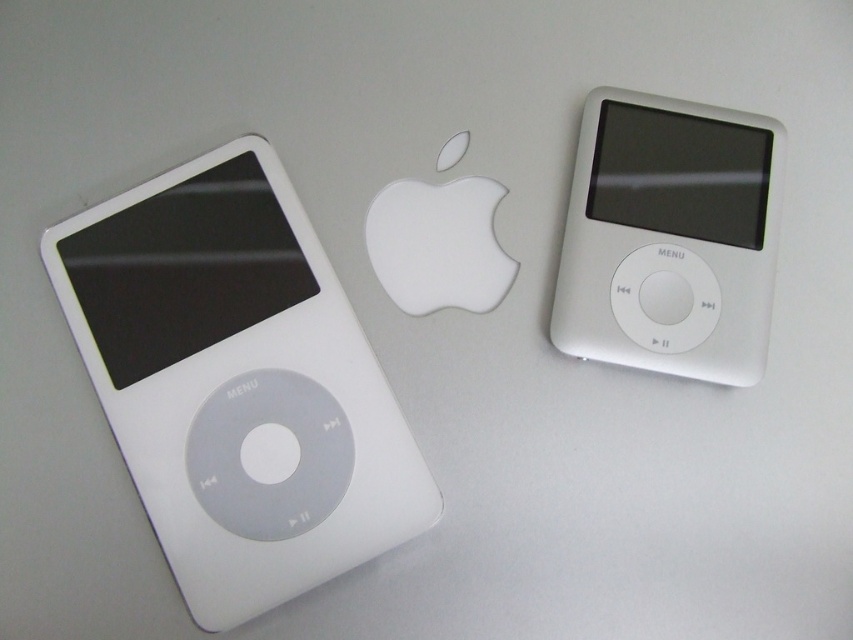
Is point (158, 330) less distant than point (572, 196)?

That is True.

Which is behind, point (141, 195) or point (699, 273)?

The point (699, 273) is more distant.

Is point (334, 570) less distant than point (717, 129)?

That is True.

This screenshot has width=853, height=640. Find the location of `white matte ipod at left`. white matte ipod at left is located at coordinates (236, 381).